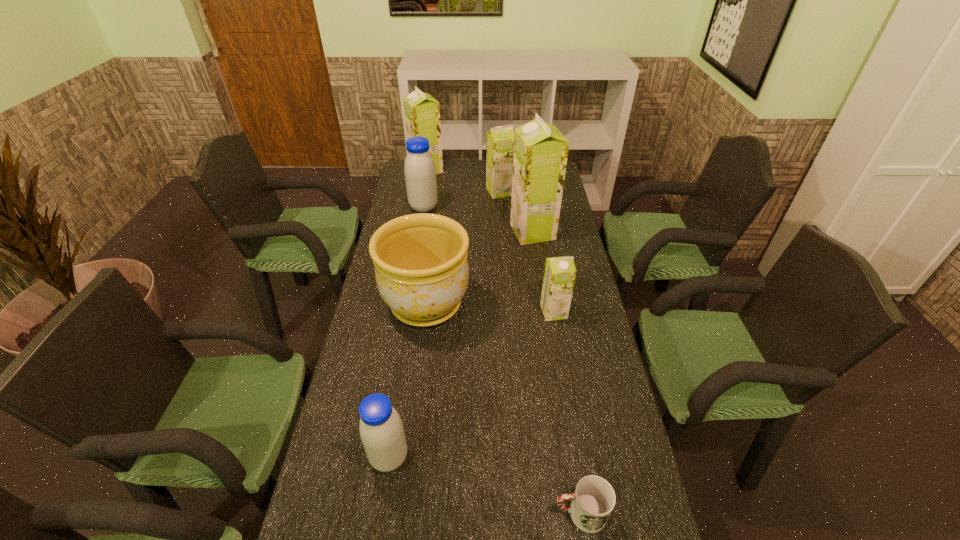
Image resolution: width=960 pixels, height=540 pixels. Find the location of `the third farthest green soya milk`. the third farthest green soya milk is located at coordinates (540, 150).

In order to click on the fourth farthest object in this screenshot , I will do `click(540, 150)`.

Image resolution: width=960 pixels, height=540 pixels. What are the coordinates of `the farthest object` in the screenshot? It's located at (422, 113).

This screenshot has height=540, width=960. Find the location of `the farthest soya milk`. the farthest soya milk is located at coordinates (422, 113).

This screenshot has height=540, width=960. In order to click on the second smallest green soya milk in this screenshot , I will do `click(500, 140)`.

Where is `the third nearest green soya milk`? Image resolution: width=960 pixels, height=540 pixels. the third nearest green soya milk is located at coordinates (500, 140).

Where is `the farther blue soya milk`? the farther blue soya milk is located at coordinates (420, 172).

You are a GUI agent. You are given a task and a screenshot of the screen. Output one action in this format:
    pyautogui.click(x=<x>, y=<y>)
    Task: Click on the bigger blue soya milk
    
    Given the screenshot: What is the action you would take?
    pyautogui.click(x=420, y=172)

You are a GUI agent. You are given a task and a screenshot of the screen. Output one action in this format:
    pyautogui.click(x=<x>, y=<y>)
    Task: Click on the flowerpot
    Image resolution: width=960 pixels, height=540 pixels.
    Given the screenshot: What is the action you would take?
    pyautogui.click(x=421, y=267)

At what (x,y) coordinates should I click in order to perform the action: click on the smallest green soya milk. Please return your answer as a coordinate pair (x, y). Looking at the image, I should click on (559, 275).